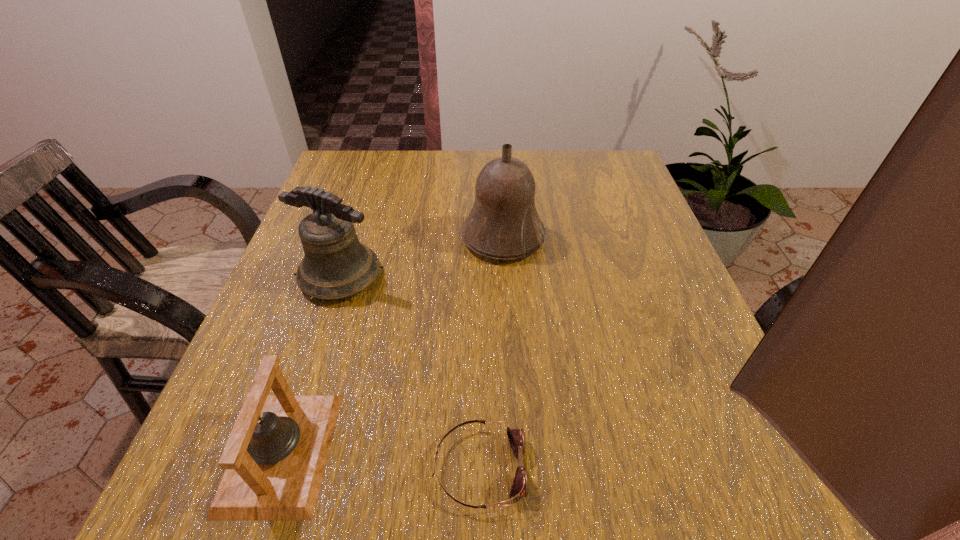
Image resolution: width=960 pixels, height=540 pixels. I want to click on the rightmost bell, so click(503, 224).

What are the coordinates of `the nearest bell` in the screenshot? It's located at (275, 457).

Locate an element on the screen. Image resolution: width=960 pixels, height=540 pixels. the third tallest object is located at coordinates (275, 457).

Find the location of a particular element. goggles is located at coordinates (520, 487).

Identify the location of vacant space located on the left of the rightmost bell. This screenshot has width=960, height=540. (372, 238).

This screenshot has height=540, width=960. Identify the location of vacant region located 0.400m on the back of the shortest bell. (352, 238).

Where is `vacant region located 0.310m through the lenses of the goggles`? vacant region located 0.310m through the lenses of the goggles is located at coordinates (746, 468).

This screenshot has width=960, height=540. I want to click on bell at the near edge, so click(275, 457).

Find the location of a particular element. The height and width of the screenshot is (540, 960). goggles present at the near edge is located at coordinates (520, 487).

Identify the location of object that is at the near left corner. (275, 457).